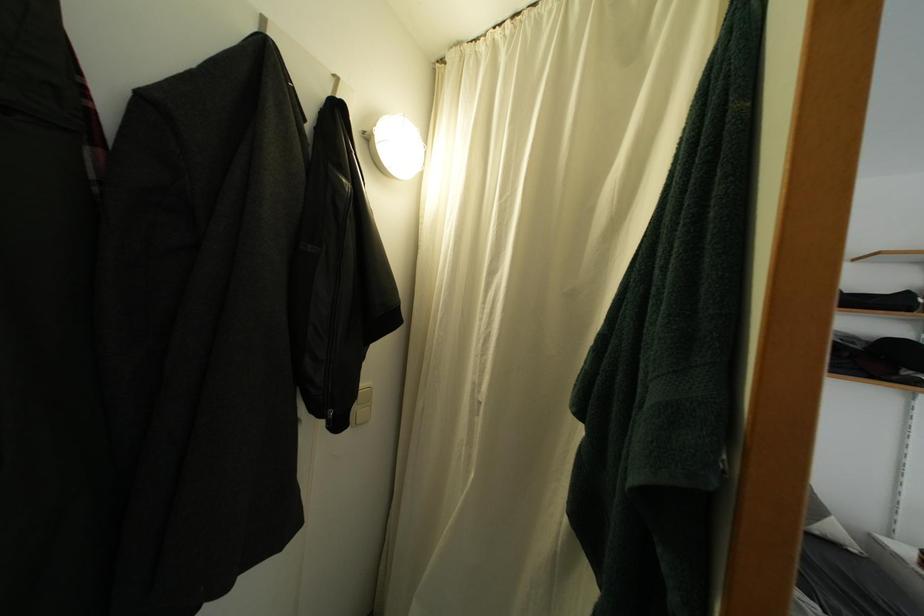
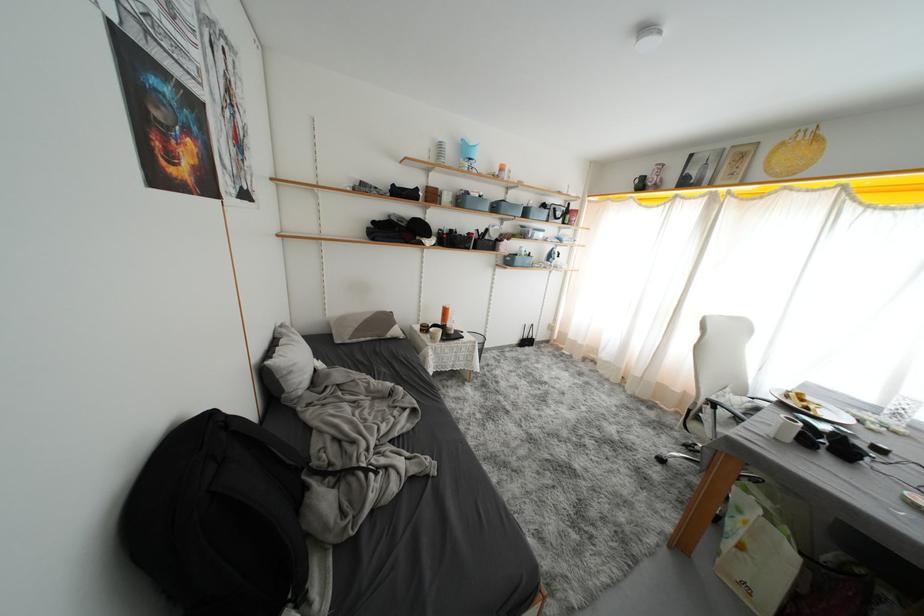
How did the camera likely rotate?

The rotation direction of the camera is right-down.